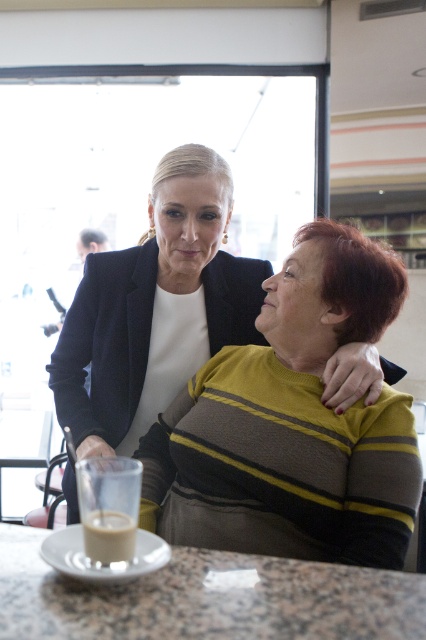
In the scene shown: Can you confirm if matte black blazer at upper left is positioned to the right of white frothy coffee at lower left?

Indeed, matte black blazer at upper left is positioned on the right side of white frothy coffee at lower left.

Does matte black blazer at upper left have a larger size compared to white frothy coffee at lower left?

Yes, matte black blazer at upper left is bigger than white frothy coffee at lower left.

Where is `matte black blazer at upper left`? This screenshot has height=640, width=426. matte black blazer at upper left is located at coordinates (155, 308).

Does matte black blazer at upper left have a greater height compared to granite table at lower center?

Yes.

Which is behind, point (95, 317) or point (294, 580)?

Positioned behind is point (95, 317).

The height and width of the screenshot is (640, 426). What are the coordinates of `matte black blazer at upper left` in the screenshot? It's located at (155, 308).

Between granite table at lower center and white frothy coffee at lower left, which one has more height?

Standing taller between the two is white frothy coffee at lower left.

Who is lower down, granite table at lower center or white frothy coffee at lower left?

Positioned lower is granite table at lower center.

Is point (126, 604) closer to viewer compared to point (95, 538)?

Yes.

Image resolution: width=426 pixels, height=640 pixels. Find the location of `granite table at lower center`. granite table at lower center is located at coordinates (207, 598).